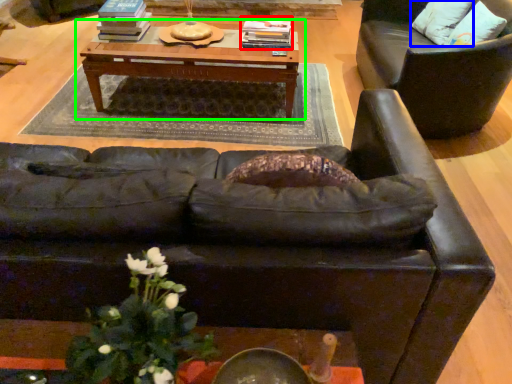
Question: Based on their relative distances, which object is farther from book (highlighted by a red box)? Choose from pillow (highlighted by a blue box) and table (highlighted by a green box).

Choices:
 (A) pillow
 (B) table

Answer: (A)